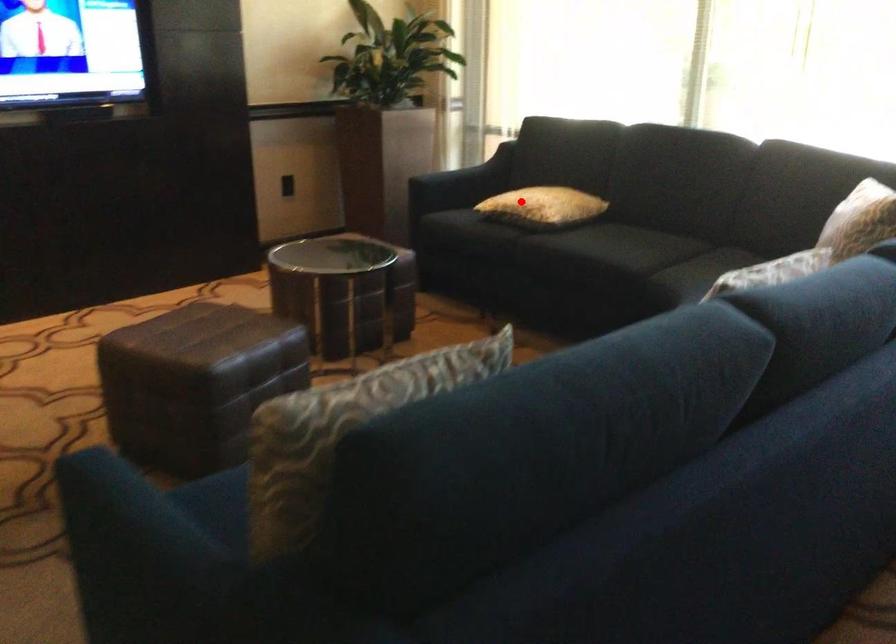
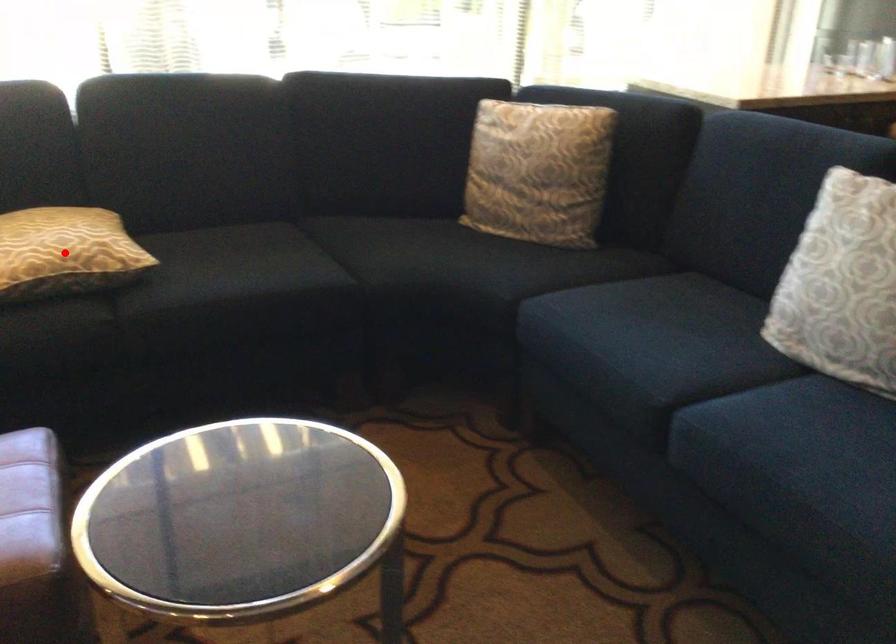
I am providing you with two images of the same scene from different viewpoints. A red point is marked on the first image and another point is marked on the second image. Do the highlighted points in image1 and image2 indicate the same real-world spot?

Yes